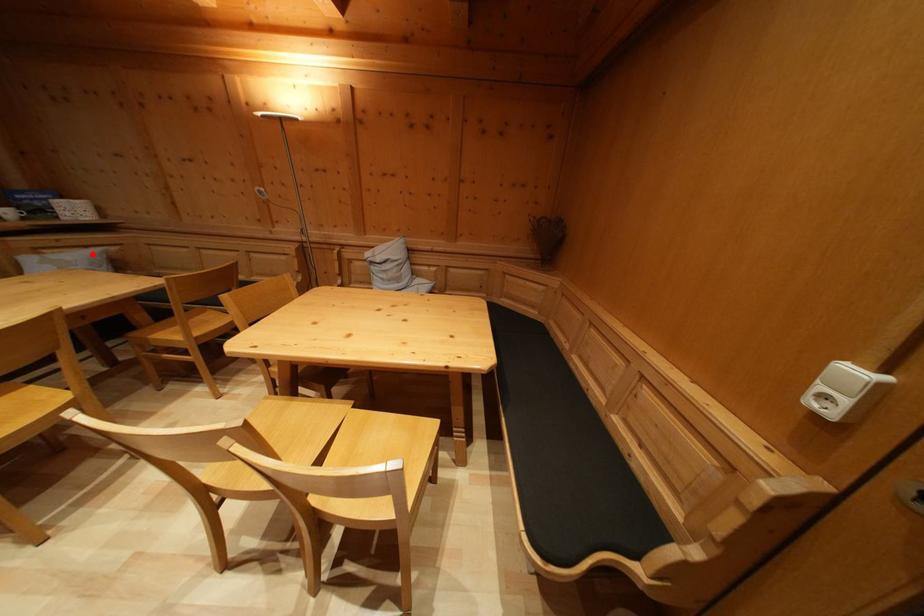
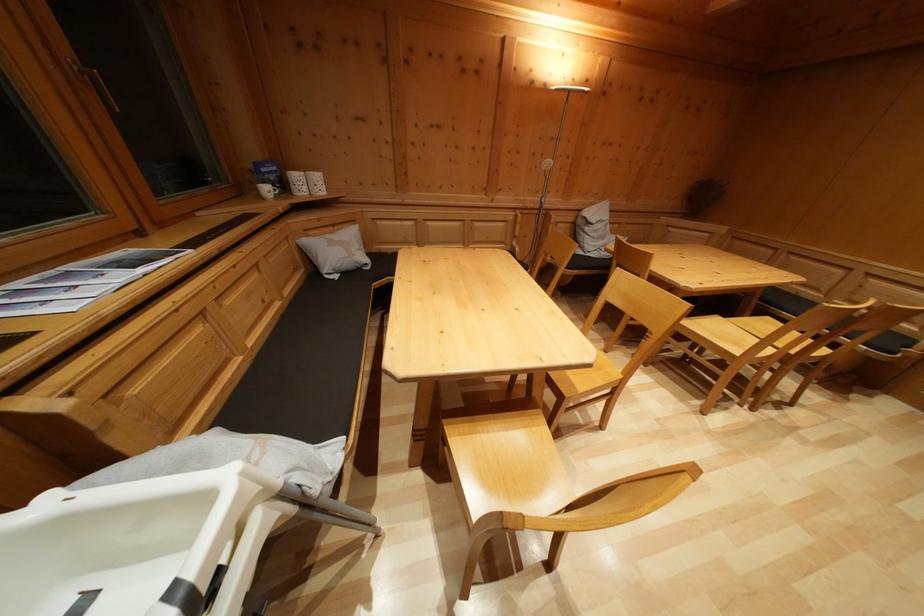
Question: I am providing you with two images of the same scene from different viewpoints. Image1 has a red point marked. In image2, the corresponding 3D location appears at what relative position? Reply with the corresponding letter.

Choices:
 (A) Closer
 (B) Farther

Answer: (A)